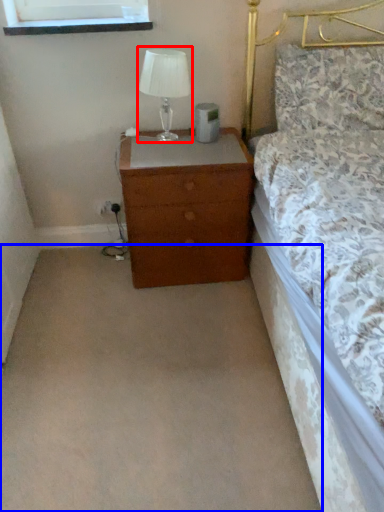
Question: Which object appears farthest to the camera in this image, table lamp (highlighted by a red box) or plain (highlighted by a blue box)?

Choices:
 (A) table lamp
 (B) plain

Answer: (A)